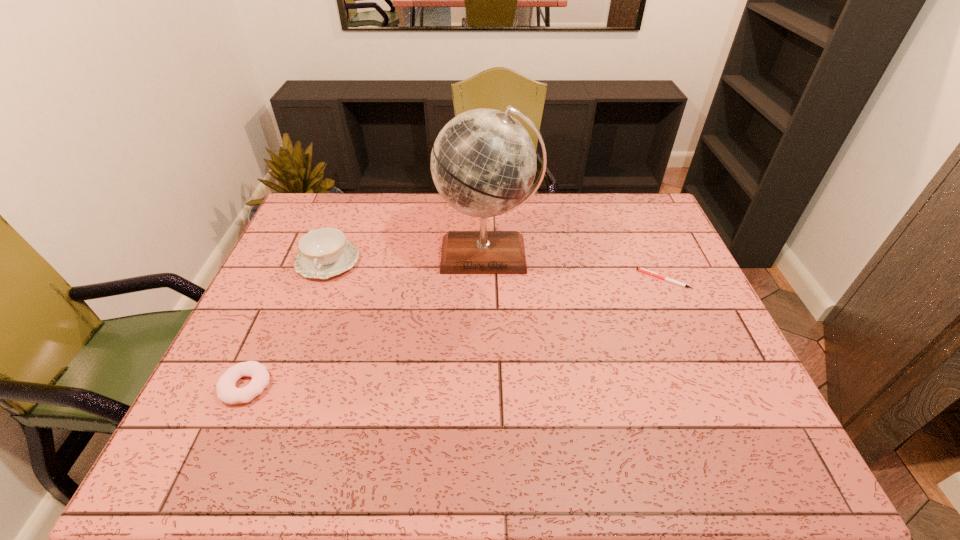
You are a GUI agent. You are given a task and a screenshot of the screen. Output one action in this format:
    pyautogui.click(x=<x>, y=<y>)
    Task: Click on the tallest object
    
    Given the screenshot: What is the action you would take?
    pyautogui.click(x=483, y=163)

The width and height of the screenshot is (960, 540). What are the coordinates of `the second object from right to left` in the screenshot? It's located at (483, 163).

What are the coordinates of `the second tallest object` in the screenshot? It's located at (324, 252).

The height and width of the screenshot is (540, 960). Find the location of `the nearest object`. the nearest object is located at coordinates (227, 392).

You are a GUI agent. You are given a task and a screenshot of the screen. Output one action in this format:
    pyautogui.click(x=<x>, y=<y>)
    Task: Click on the second shortest object
    The width and height of the screenshot is (960, 540).
    Given the screenshot: What is the action you would take?
    pyautogui.click(x=227, y=392)

Identify the location of the rightmost object. The image size is (960, 540). (639, 269).

Locate an element on the screen. This screenshot has height=540, width=960. pen is located at coordinates (639, 269).

Where is `free space located at the equator of the globe`? free space located at the equator of the globe is located at coordinates (490, 382).

The height and width of the screenshot is (540, 960). I want to click on vacant space situated on the handle side of the chinaware, so click(x=278, y=388).

You are a GUI agent. You are given a task and a screenshot of the screen. Output one action in this format:
    pyautogui.click(x=<x>, y=<y>)
    Task: Click on the vacant space located on the back of the second shortest object
    
    Given the screenshot: What is the action you would take?
    pyautogui.click(x=300, y=266)